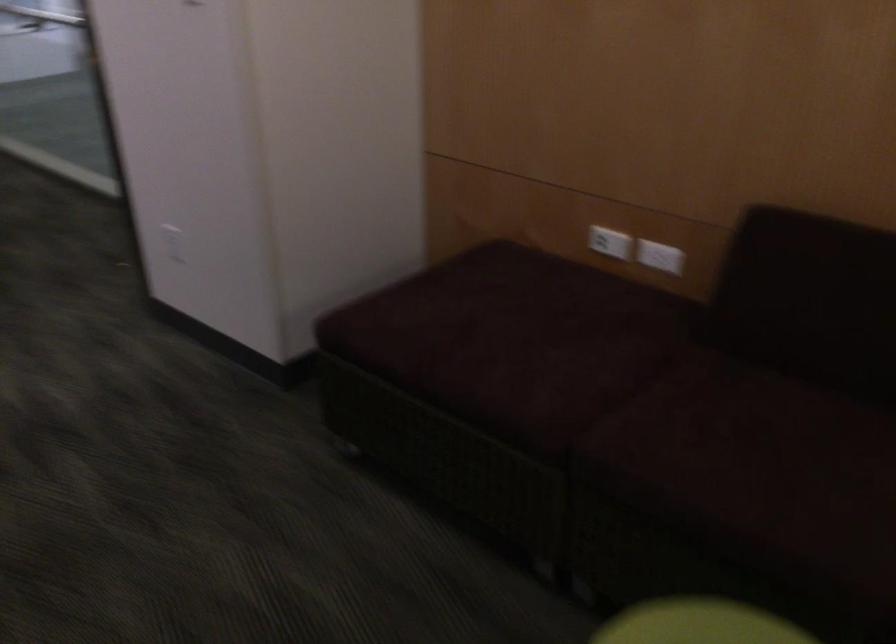
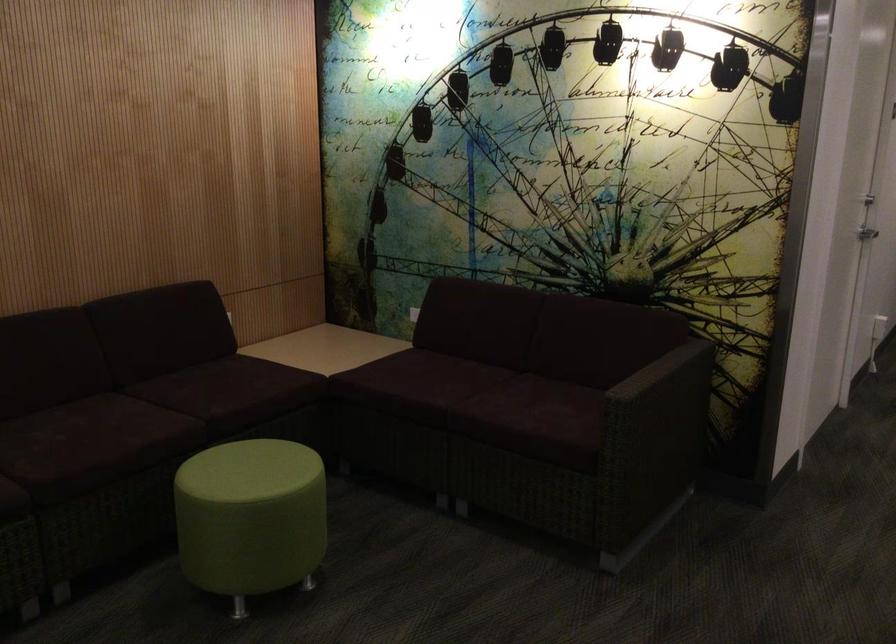
Find the pixel in the second image that matches (x=690, y=436) in the first image.

(67, 440)